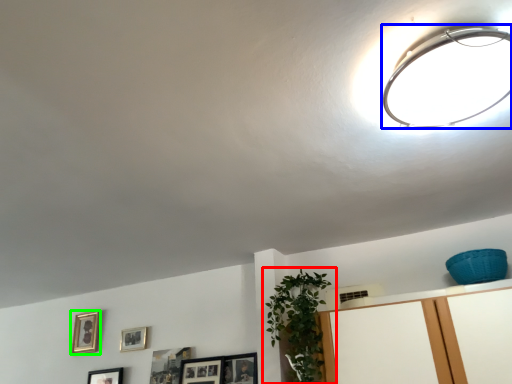
Question: Considering the real-world distances, which object is farthest from houseplant (highlighted by a red box)? lamp (highlighted by a blue box) or picture frame (highlighted by a green box)?

Choices:
 (A) lamp
 (B) picture frame

Answer: (B)